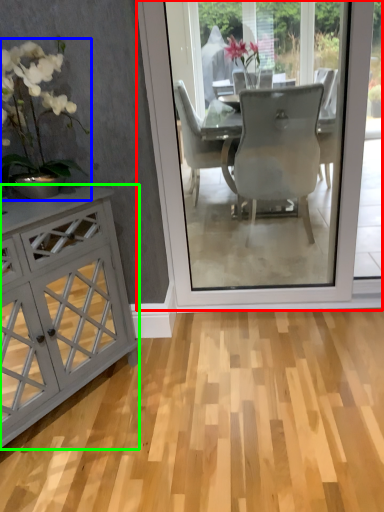
Question: Which object is the closest to the screen door (highlighted by a red box)? Choose among these: houseplant (highlighted by a blue box) or cabinetry (highlighted by a green box).

Choices:
 (A) houseplant
 (B) cabinetry

Answer: (B)